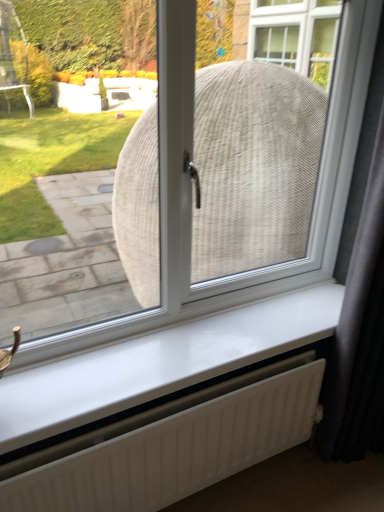
Question: Can you confirm if black fabric curtain at right is bigger than white matte radiator at lower center?

Choices:
 (A) no
 (B) yes

Answer: (B)

Question: Considering the relative sizes of black fabric curtain at right and white matte radiator at lower center in the image provided, is black fabric curtain at right smaller than white matte radiator at lower center?

Choices:
 (A) no
 (B) yes

Answer: (A)

Question: From the image's perspective, does black fabric curtain at right appear higher than white matte radiator at lower center?

Choices:
 (A) yes
 (B) no

Answer: (A)

Question: Is black fabric curtain at right closer to camera compared to white matte radiator at lower center?

Choices:
 (A) no
 (B) yes

Answer: (B)

Question: Would you say black fabric curtain at right contains white matte radiator at lower center?

Choices:
 (A) yes
 (B) no

Answer: (B)

Question: From a real-world perspective, relative to white glossy window sill at center, is white matte radiator at lower center vertically above or below?

Choices:
 (A) below
 (B) above

Answer: (A)

Question: Is white matte radiator at lower center taller or shorter than white glossy window sill at center?

Choices:
 (A) short
 (B) tall

Answer: (B)

Question: Considering their positions, is white matte radiator at lower center located in front of or behind white glossy window sill at center?

Choices:
 (A) front
 (B) behind

Answer: (A)

Question: Based on their sizes in the image, would you say white matte radiator at lower center is bigger or smaller than white glossy window sill at center?

Choices:
 (A) small
 (B) big

Answer: (B)

Question: From a real-world perspective, relative to white matte radiator at lower center, is white glossy window sill at center vertically above or below?

Choices:
 (A) above
 (B) below

Answer: (A)

Question: In terms of width, does white glossy window sill at center look wider or thinner when compared to white matte radiator at lower center?

Choices:
 (A) wide
 (B) thin

Answer: (A)

Question: In the image, is white glossy window sill at center positioned in front of or behind white matte radiator at lower center?

Choices:
 (A) front
 (B) behind

Answer: (B)

Question: Considering the positions of white glossy window sill at center and white matte radiator at lower center in the image, is white glossy window sill at center taller or shorter than white matte radiator at lower center?

Choices:
 (A) short
 (B) tall

Answer: (A)

Question: Looking at the image, does black fabric curtain at right seem bigger or smaller compared to white glossy window sill at center?

Choices:
 (A) big
 (B) small

Answer: (A)

Question: Is black fabric curtain at right wider or thinner than white glossy window sill at center?

Choices:
 (A) wide
 (B) thin

Answer: (A)